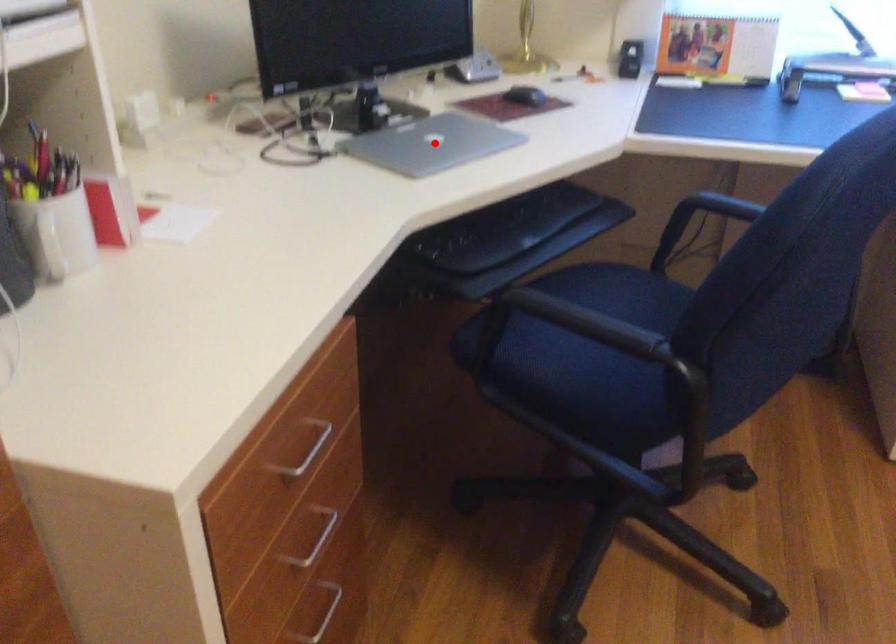
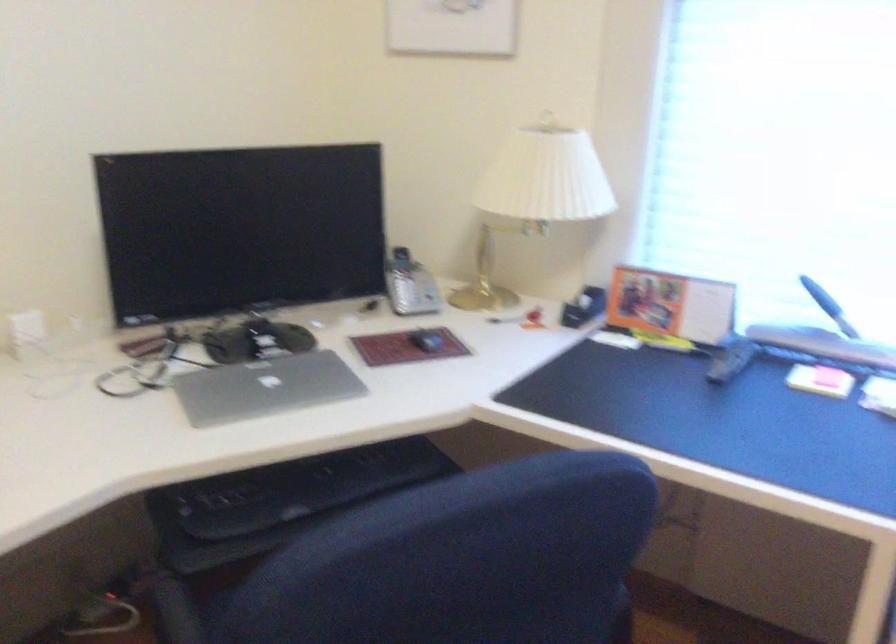
In the second image, find the point that corresponds to the highlighted location in the first image.

(264, 386)